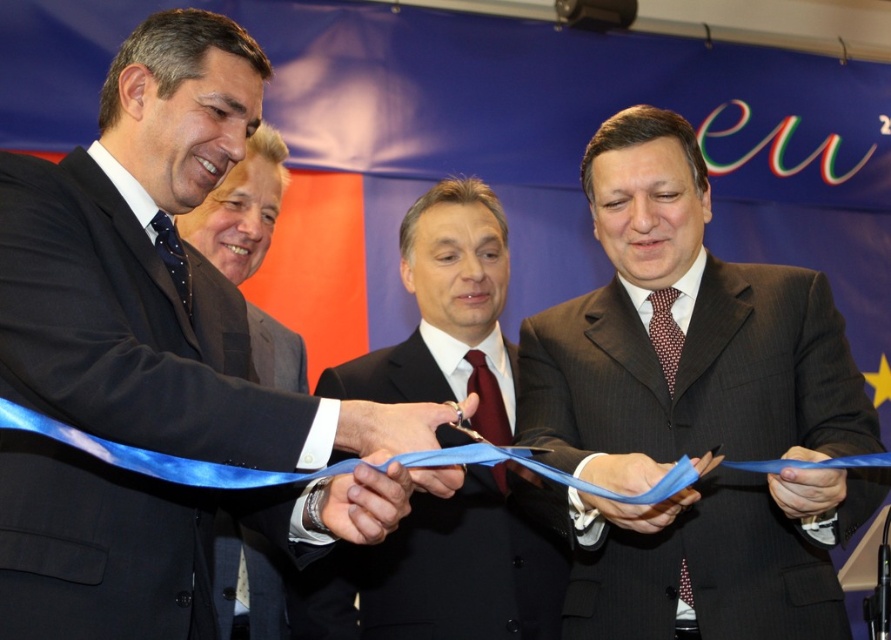
Between blue fabric ribbon at center and blue fabric ribbon at lower center, which one is positioned lower?

blue fabric ribbon at lower center is below.

Measure the distance from blue fabric ribbon at center to blue fabric ribbon at lower center.

60.55 centimeters

At what (x,y) coordinates should I click in order to perform the action: click on blue fabric ribbon at center. Please return your answer as a coordinate pair (x, y). This screenshot has width=891, height=640. Looking at the image, I should click on (394, 426).

Describe the element at coordinates (681, 332) in the screenshot. I see `dark brown suit at center` at that location.

In the scene shown: Does dark brown suit at center have a greater height compared to blue fabric ribbon at center?

Correct, dark brown suit at center is much taller as blue fabric ribbon at center.

The height and width of the screenshot is (640, 891). I want to click on dark brown suit at center, so click(x=681, y=332).

Between dark brown suit at center and dark gray pinstripe suit at center, which one appears on the left side from the viewer's perspective?

From the viewer's perspective, dark gray pinstripe suit at center appears more on the left side.

Consider the image. Between dark brown suit at center and dark gray pinstripe suit at center, which one is positioned lower?

dark gray pinstripe suit at center

Does point (673, 609) lie in front of point (372, 570)?

Yes, it is.

This screenshot has height=640, width=891. What are the coordinates of `dark brown suit at center` in the screenshot? It's located at (681, 332).